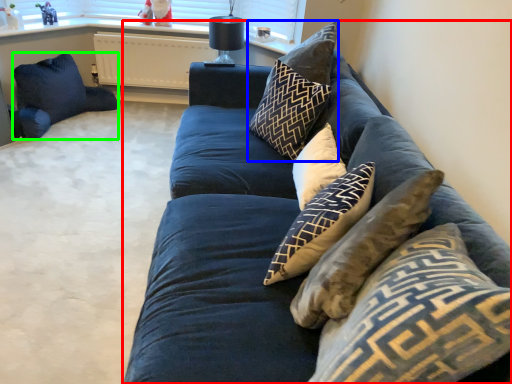
Question: Which object is the closest to the studio couch (highlighted by a red box)? Choose among these: pillow (highlighted by a blue box) or pillow (highlighted by a green box).

Choices:
 (A) pillow
 (B) pillow

Answer: (A)